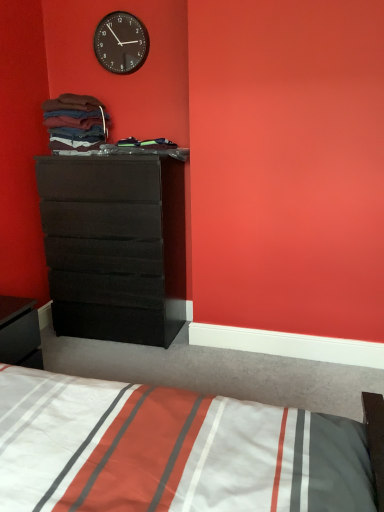
Locate an element on the screen. free space in front of matte black dresser at left is located at coordinates (122, 362).